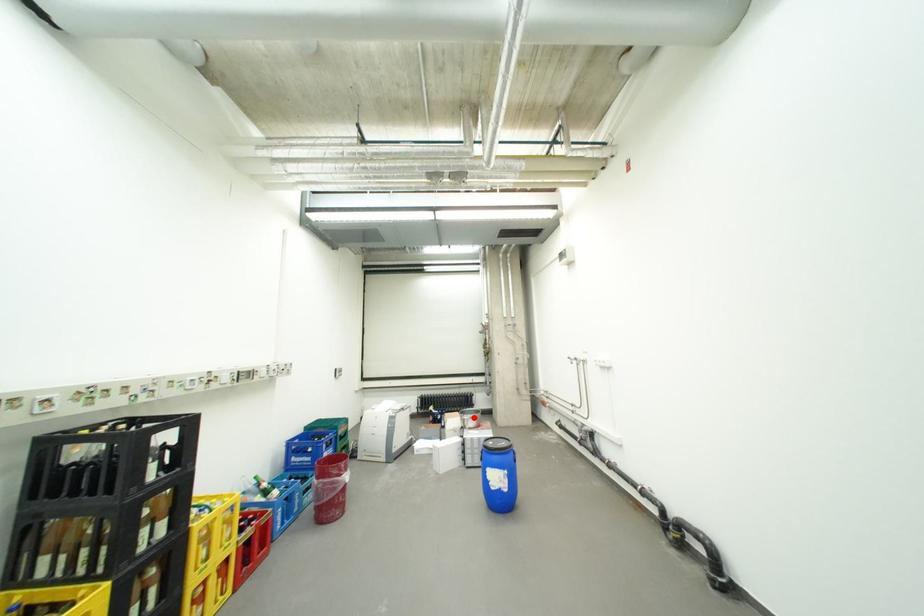
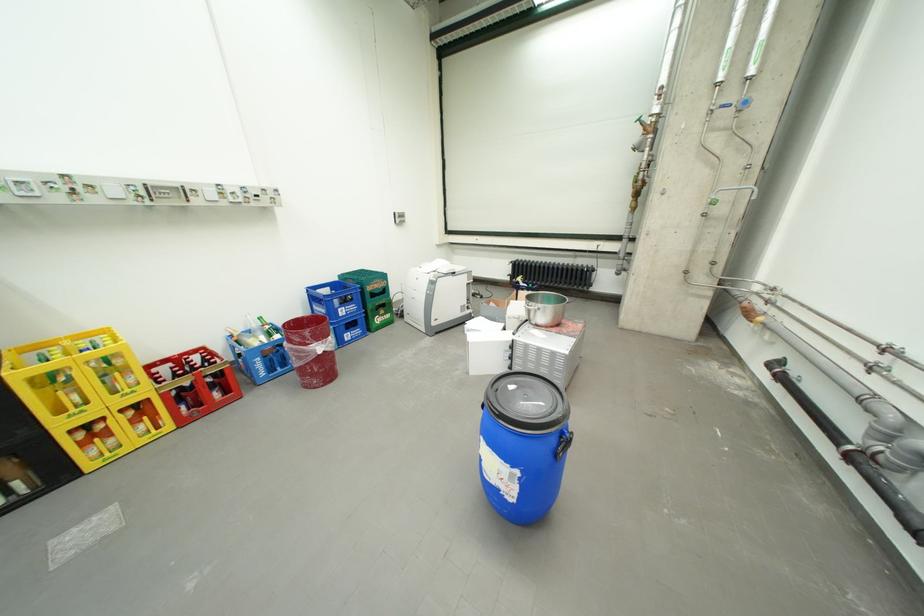
Question: I am providing you with two images of the same scene from different viewpoints. A red point is marked on the first image. At the location where the point appears in image 1, is it still visible in image 2?

Choices:
 (A) Yes
 (B) No

Answer: (A)